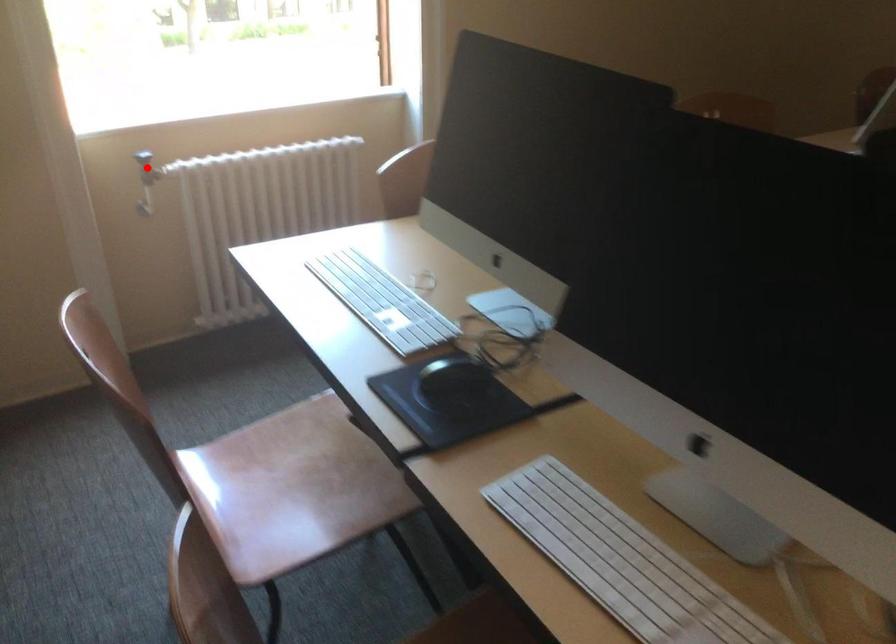
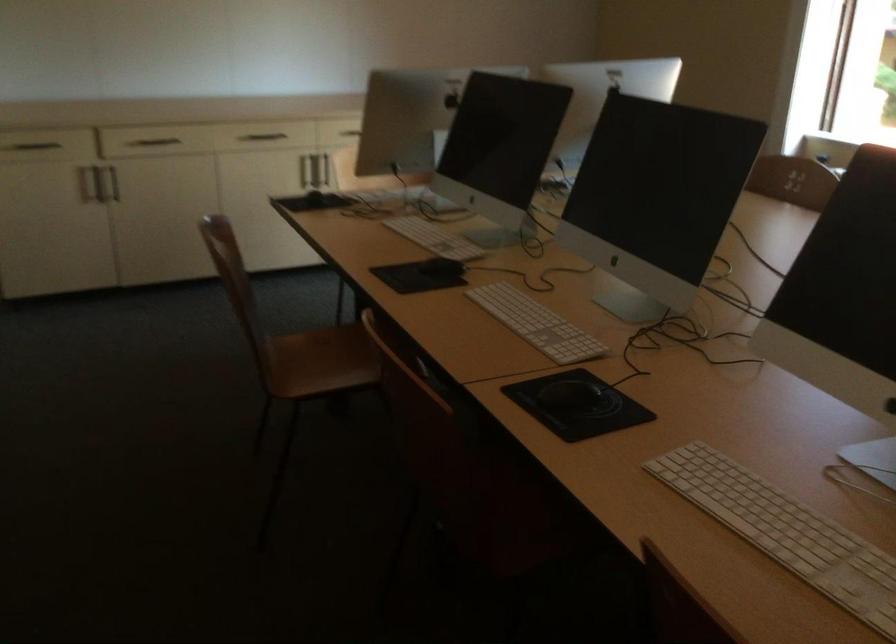
Question: I am providing you with two images of the same scene from different viewpoints. A red point is marked on the first image. Can you still see the location of the red point in image 2?

Choices:
 (A) Yes
 (B) No

Answer: (B)